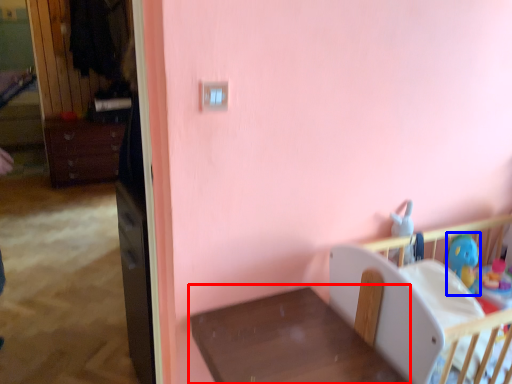
Question: Which object appears closest to the camera in this image, furniture (highlighted by a red box) or toy (highlighted by a blue box)?

Choices:
 (A) furniture
 (B) toy

Answer: (A)